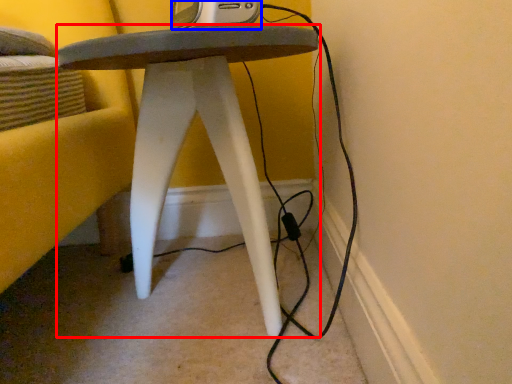
Question: Which point is closer to the camera, stool (highlighted by a red box) or gadget (highlighted by a blue box)?

Choices:
 (A) stool
 (B) gadget

Answer: (A)